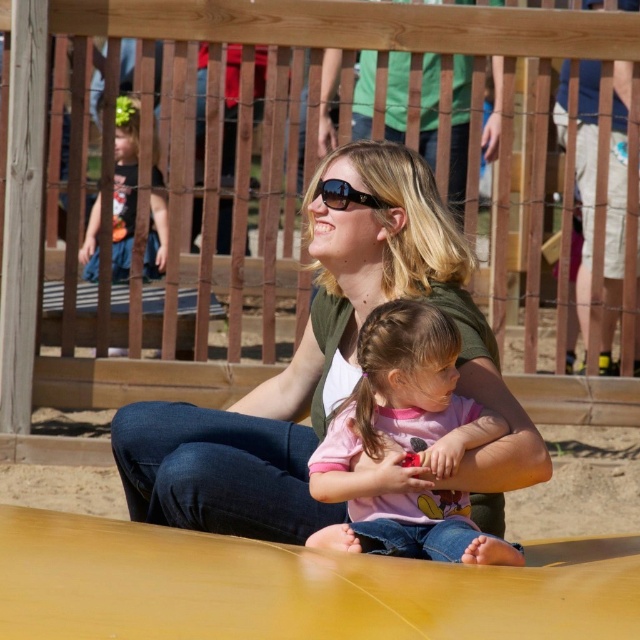
Does matte green shirt at center come in front of pink matte shirt at center?

That is False.

Consider the image. Is matte green shirt at center positioned behind pink matte shirt at center?

Yes, it is behind pink matte shirt at center.

Identify the location of matte green shirt at center. The width and height of the screenshot is (640, 640). (330, 372).

Locate an element on the screen. The height and width of the screenshot is (640, 640). matte green shirt at center is located at coordinates (330, 372).

Which is above, matte black shirt at upper left or sunglasses at center?

matte black shirt at upper left is above.

Where is `matte black shirt at upper left`? Image resolution: width=640 pixels, height=640 pixels. matte black shirt at upper left is located at coordinates (124, 184).

Which of these two, matte green shirt at center or matte black shirt at upper left, stands taller?

With more height is matte black shirt at upper left.

Where is `matte green shirt at center`? The image size is (640, 640). matte green shirt at center is located at coordinates (330, 372).

The height and width of the screenshot is (640, 640). I want to click on matte green shirt at center, so click(x=330, y=372).